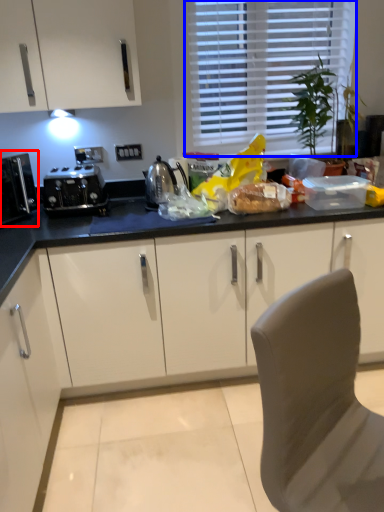
Question: Which point is further to the camera, kitchen appliance (highlighted by a red box) or window (highlighted by a blue box)?

Choices:
 (A) kitchen appliance
 (B) window

Answer: (B)